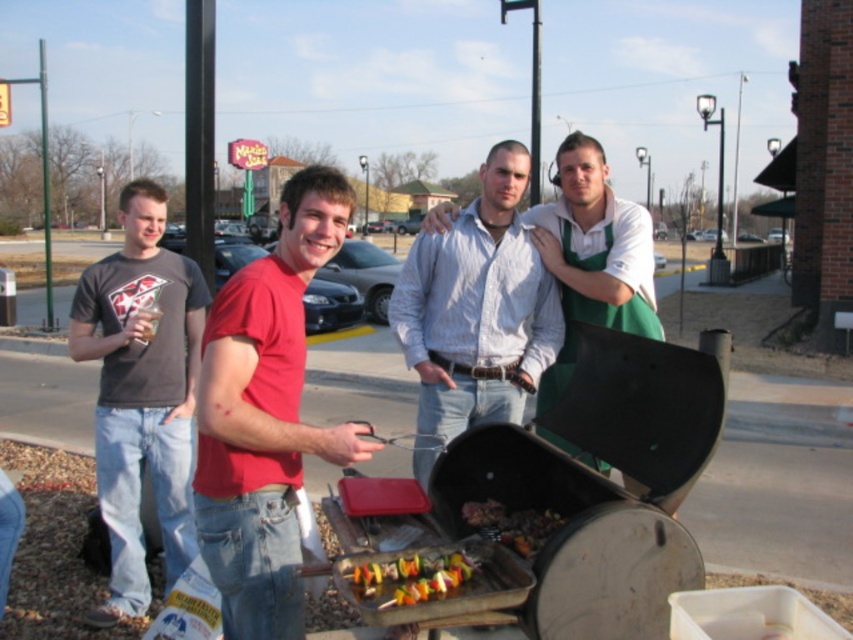
Question: Does black matte barbecue grill at center appear on the left side of multicolored skewers at center?

Choices:
 (A) no
 (B) yes

Answer: (A)

Question: Among these points, which one is farthest from the camera?

Choices:
 (A) (419, 564)
 (B) (433, 300)
 (C) (247, 280)

Answer: (B)

Question: Which point appears closest to the camera in this image?

Choices:
 (A) (514, 545)
 (B) (344, 531)
 (C) (413, 568)
 (D) (283, 584)

Answer: (C)

Question: Considering the real-world distances, which object is farthest from the matte red shirt at center?

Choices:
 (A) white textured shirt at center
 (B) black matte barbecue grill at center
 (C) matte gray t-shirt at left

Answer: (C)

Question: Can you confirm if black matte barbecue grill at center is thinner than multicolored skewers at center?

Choices:
 (A) yes
 (B) no

Answer: (B)

Question: Considering the relative positions of matte red shirt at center and grilled skewers at center in the image provided, where is matte red shirt at center located with respect to grilled skewers at center?

Choices:
 (A) left
 (B) right

Answer: (A)